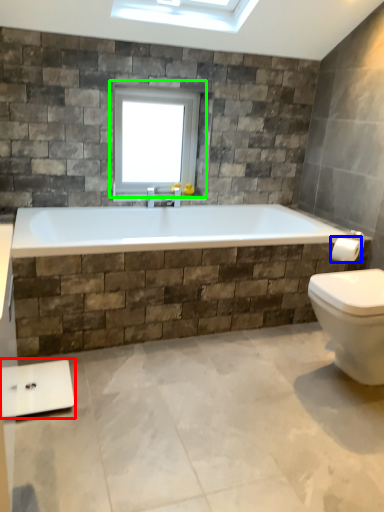
Question: Considering the real-world distances, which object is farthest from scale (highlighted by a red box)? towel bar (highlighted by a blue box) or window (highlighted by a green box)?

Choices:
 (A) towel bar
 (B) window

Answer: (A)